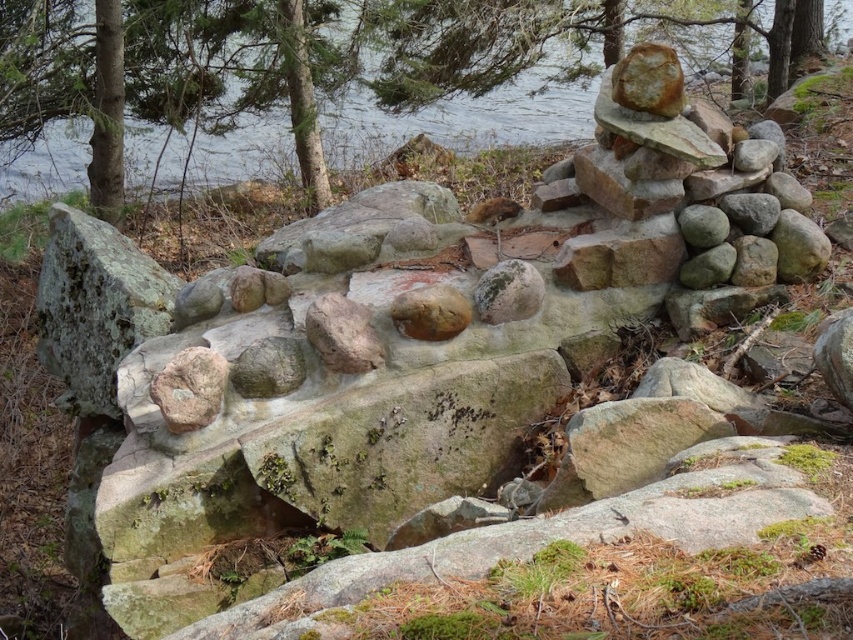
You are standing at the origin point of the coordinate system. Where is the rusty brown rock at center located in terms of coordinates?

The rusty brown rock at center is located at point (189, 388).

You are standing in front of a stone structure and see the smooth gray rock at center and the rusty metallic rock at center. Which one is nearer to you?

The smooth gray rock at center is closer to the viewer than the rusty metallic rock at center.